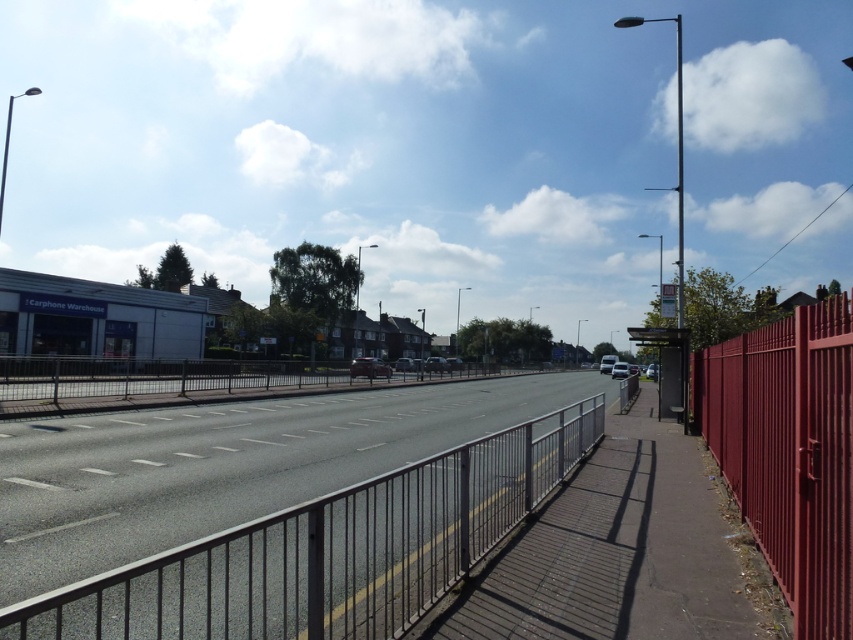
Question: Is metallic silver rail at center closer to camera compared to smooth glossy red fence at right?

Choices:
 (A) yes
 (B) no

Answer: (A)

Question: Among these objects, which one is farthest from the camera?

Choices:
 (A) metallic silver rail at center
 (B) smooth glossy red fence at right

Answer: (B)

Question: In this image, where is metallic silver rail at center located relative to smooth glossy red fence at right?

Choices:
 (A) above
 (B) below

Answer: (B)

Question: Can you confirm if metallic silver rail at center is positioned below smooth glossy red fence at right?

Choices:
 (A) no
 (B) yes

Answer: (B)